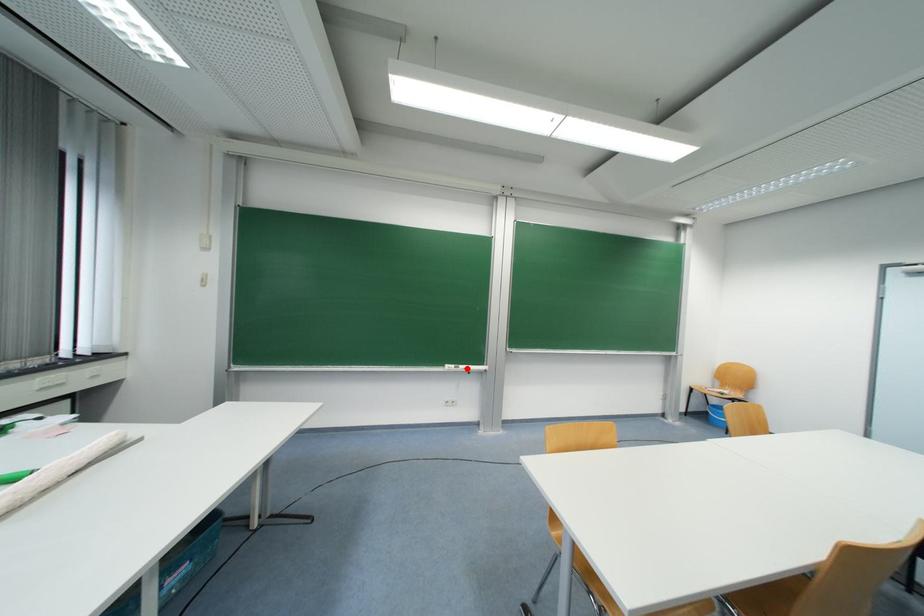
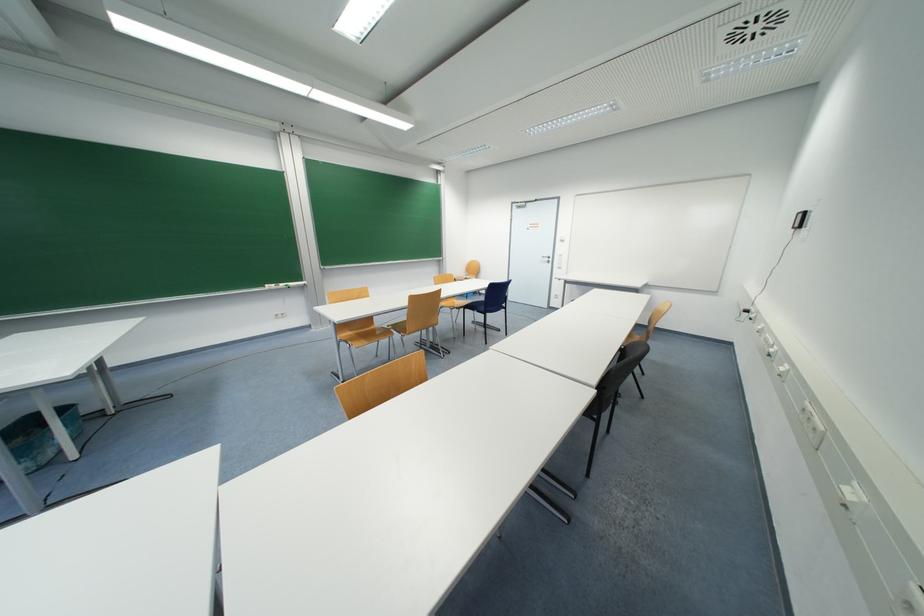
In the second image, find the point that corresponds to the highlighted location in the first image.

(286, 286)